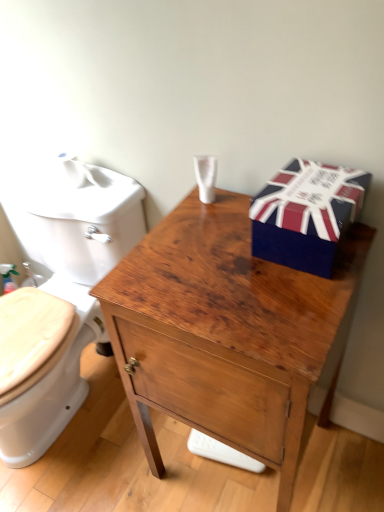
I want to click on blank space to the left of union jack-patterned cardboard box at upper right, so click(x=221, y=246).